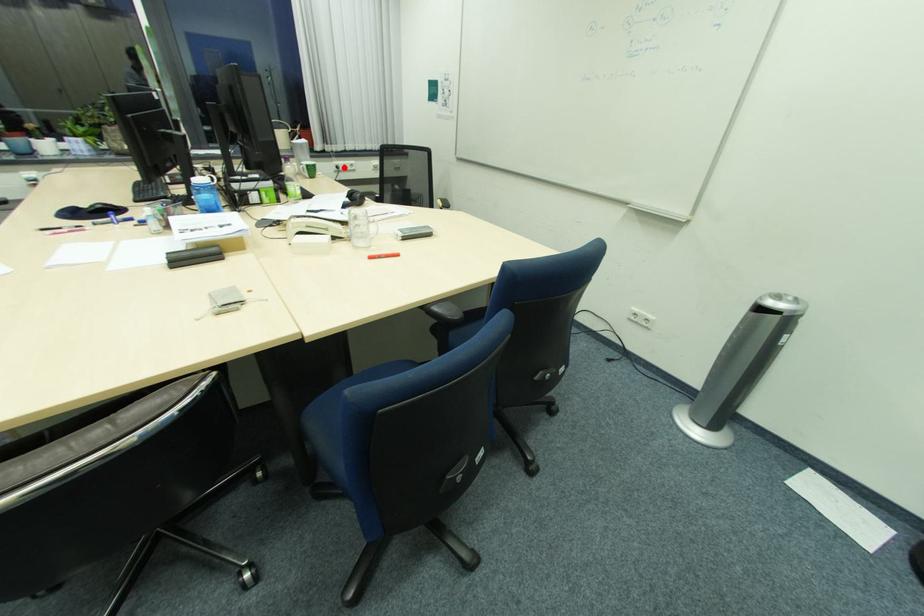
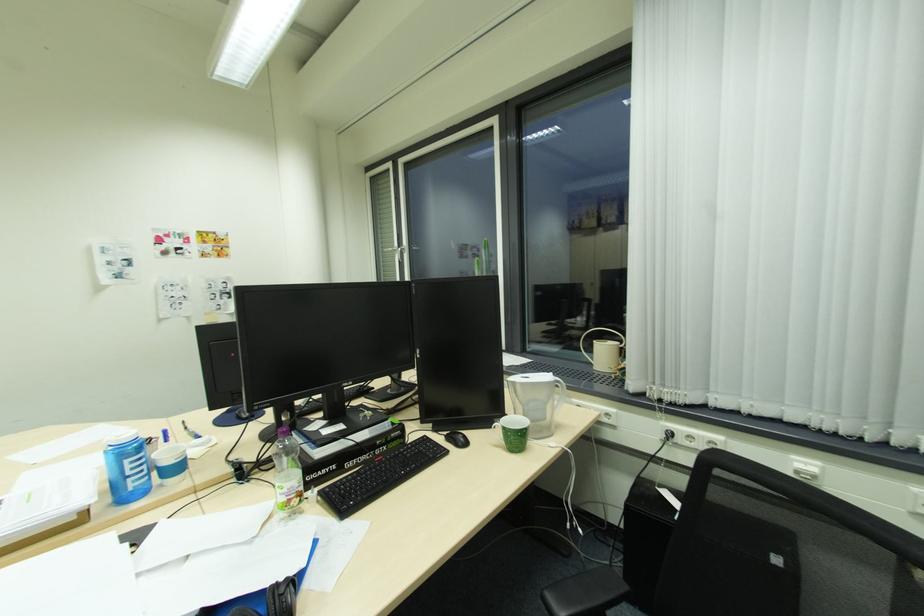
The point at the highlighted location is marked in the first image. Where is the corresponding point in the second image?

(675, 435)